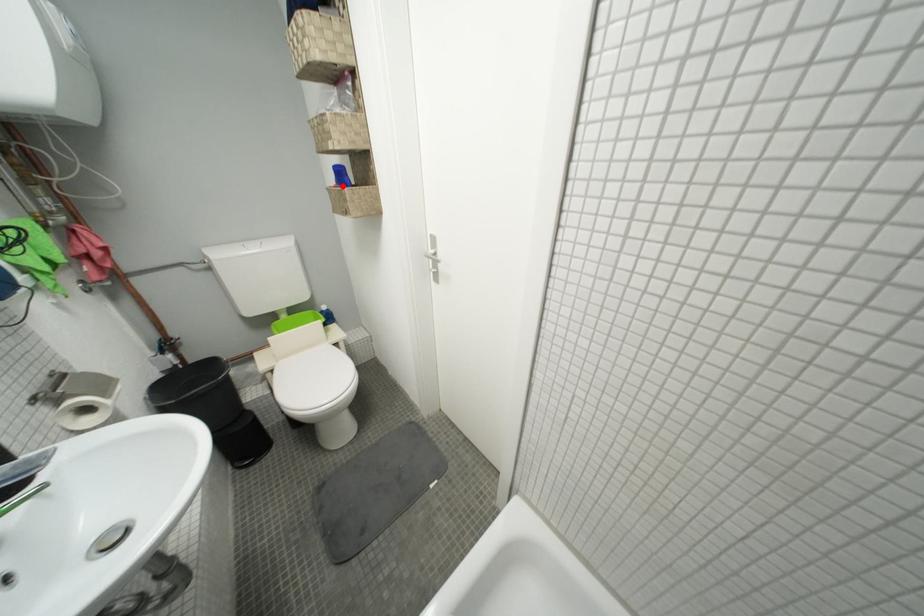
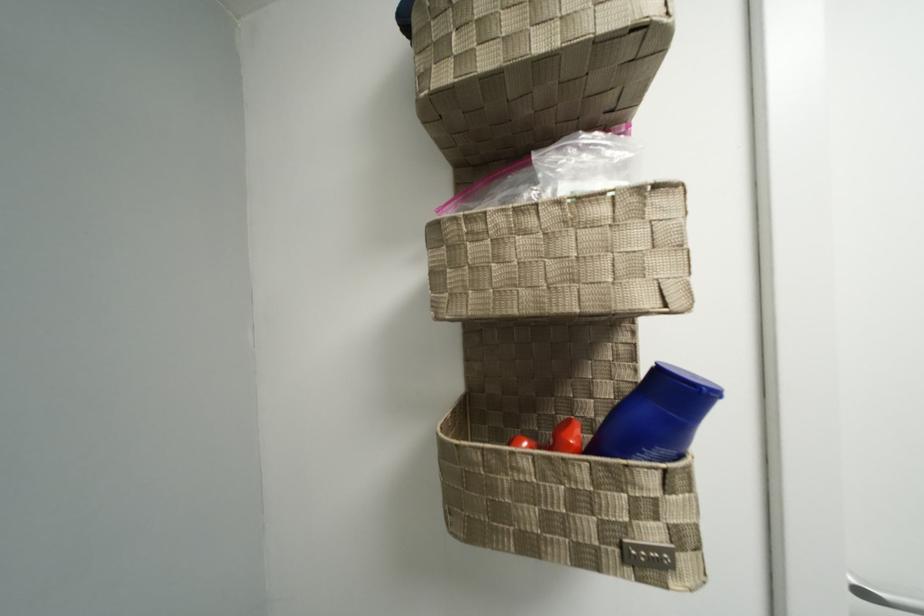
In the second image, find the point that corresponds to the highlighted location in the first image.

(689, 450)